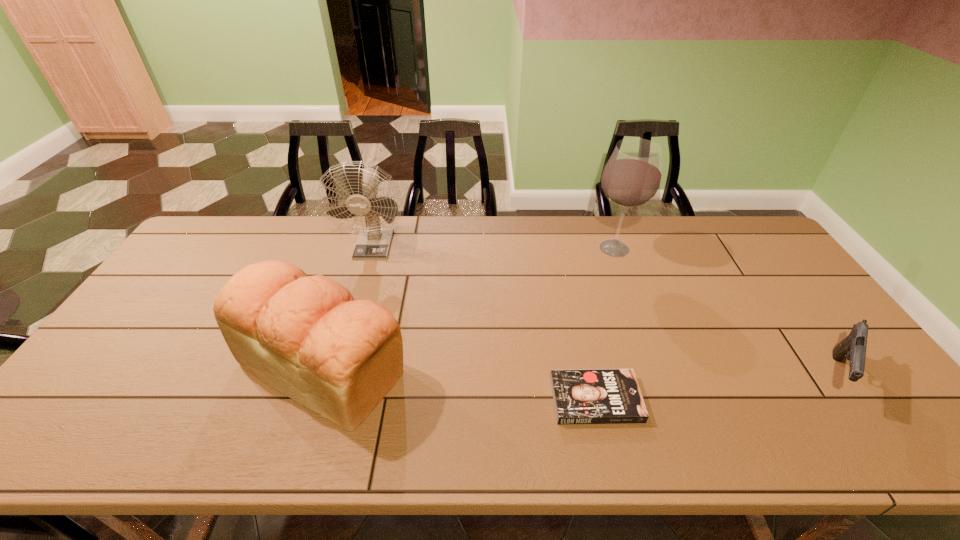
Identify the location of alcohol. (632, 177).

Find the location of a particular element. fan is located at coordinates click(x=373, y=242).

In order to click on the third shortest object in this screenshot , I will do `click(305, 336)`.

The width and height of the screenshot is (960, 540). In order to click on gun in this screenshot , I will do `click(853, 347)`.

At what (x,y) coordinates should I click in order to perform the action: click on the fourth tallest object. Please return your answer as a coordinate pair (x, y). Image resolution: width=960 pixels, height=540 pixels. Looking at the image, I should click on (853, 347).

Where is `book`? Image resolution: width=960 pixels, height=540 pixels. book is located at coordinates (582, 396).

What are the coordinates of `vacant space positioned on the front of the alcohol` in the screenshot? It's located at (656, 363).

Where is `blank area located on the air flow direction of the fan`? blank area located on the air flow direction of the fan is located at coordinates (347, 339).

You are a GUI agent. You are given a task and a screenshot of the screen. Output one action in this format:
    pyautogui.click(x=<x>, y=<y>)
    Task: Click on the free space located on the back of the third shortest object
    The image size is (960, 540).
    Given the screenshot: What is the action you would take?
    pyautogui.click(x=355, y=264)

Find the location of a particular element. vacant space located 0.110m at the muzzle of the fourth tallest object is located at coordinates (889, 452).